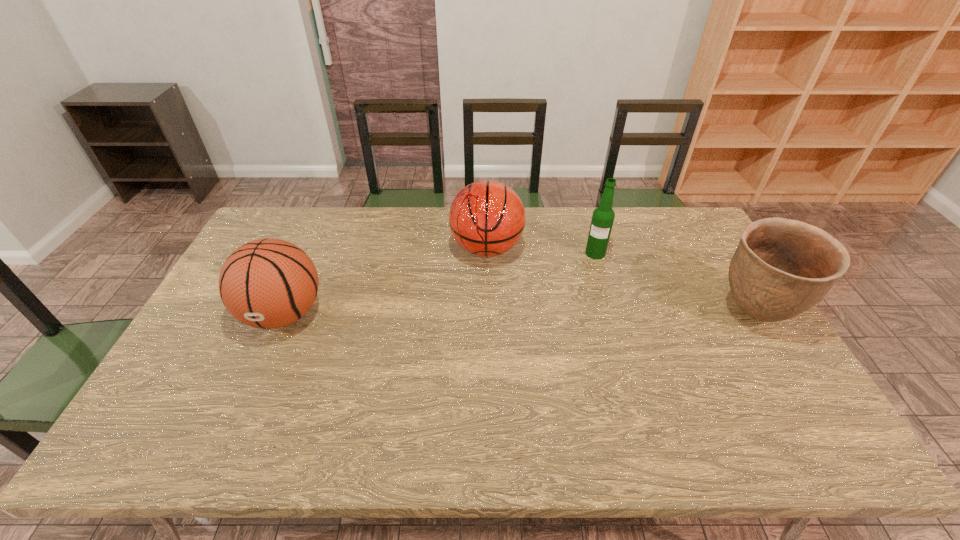
Image resolution: width=960 pixels, height=540 pixels. I want to click on unoccupied position between the beer bottle and the second object from left to right, so click(541, 251).

Locate an element on the screen. The height and width of the screenshot is (540, 960). free space between the beer bottle and the rightmost object is located at coordinates (675, 284).

I want to click on free space between the farther basketball and the beer bottle, so click(541, 251).

Where is `object that is the closest one to the rightmost object`? The height and width of the screenshot is (540, 960). object that is the closest one to the rightmost object is located at coordinates (603, 216).

You are a GUI agent. You are given a task and a screenshot of the screen. Output one action in this format:
    pyautogui.click(x=<x>, y=<y>)
    Task: Click on the closest object to the rightmost object
    Image resolution: width=960 pixels, height=540 pixels.
    Given the screenshot: What is the action you would take?
    pyautogui.click(x=603, y=216)

Locate an element on the screen. The height and width of the screenshot is (540, 960). free location that satisfies the following two spatial constraints: 1. on the front side of the pottery; 2. on the left side of the beer bottle is located at coordinates (613, 314).